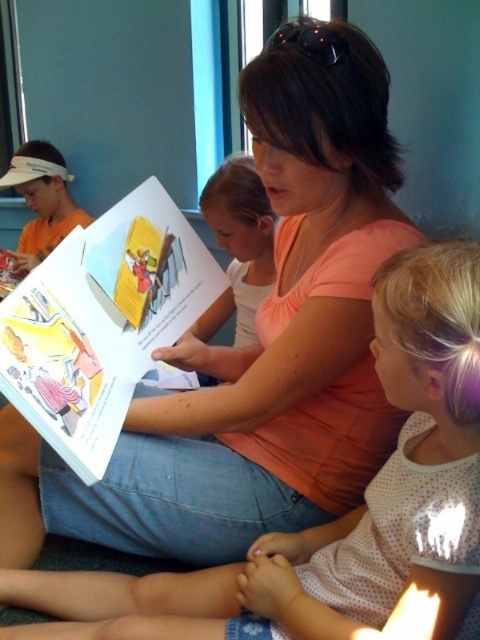
Is polka dot fabric dress at lower right bigger than matte paper book at center?

Correct, polka dot fabric dress at lower right is larger in size than matte paper book at center.

This screenshot has height=640, width=480. I want to click on polka dot fabric dress at lower right, so click(x=348, y=513).